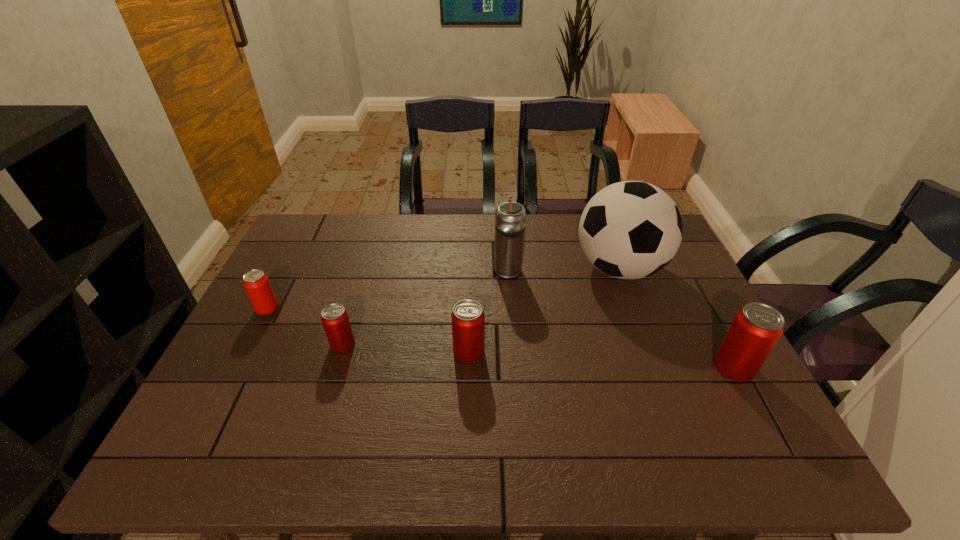
At what (x,y) coordinates should I click in order to perform the action: click on vacant area between the tallest object and the fourth object from right to left. Please return your answer as a coordinate pair (x, y). The width and height of the screenshot is (960, 540). Looking at the image, I should click on (544, 310).

This screenshot has width=960, height=540. I want to click on vacant area that lies between the third tallest object and the soccer ball, so click(x=677, y=318).

Image resolution: width=960 pixels, height=540 pixels. Find the location of `unoccupied position between the tallest object and the fourth object from left to right`. unoccupied position between the tallest object and the fourth object from left to right is located at coordinates (564, 268).

I want to click on free point between the shortest can and the second tallest can, so click(406, 348).

At what (x,y) coordinates should I click in order to perform the action: click on vacant space in between the fourth object from right to left and the leftmost object. Please return your answer as a coordinate pair (x, y). The height and width of the screenshot is (540, 960). Looking at the image, I should click on (369, 330).

Where is `free space that is in between the leftmost object and the shortest can`? The width and height of the screenshot is (960, 540). free space that is in between the leftmost object and the shortest can is located at coordinates (305, 327).

Find the location of a particular element. The width and height of the screenshot is (960, 540). vacant area between the thermos bottle and the tallest can is located at coordinates (621, 318).

At what (x,y) coordinates should I click in order to perform the action: click on vacant area between the soccer ball and the thermos bottle. Please return your answer as a coordinate pair (x, y). The width and height of the screenshot is (960, 540). Looking at the image, I should click on tap(564, 268).

Select which object appears as the fifth closest to the beer can. Please provide its 2D coordinates. Your answer should be formatted as a tuple, i.e. [(x, y)], where the tuple contains the x and y coordinates of a point satisfying the conditions above.

[(756, 329)]

Where is `object identified as the fourth closest to the tallest can`? object identified as the fourth closest to the tallest can is located at coordinates click(x=335, y=320).